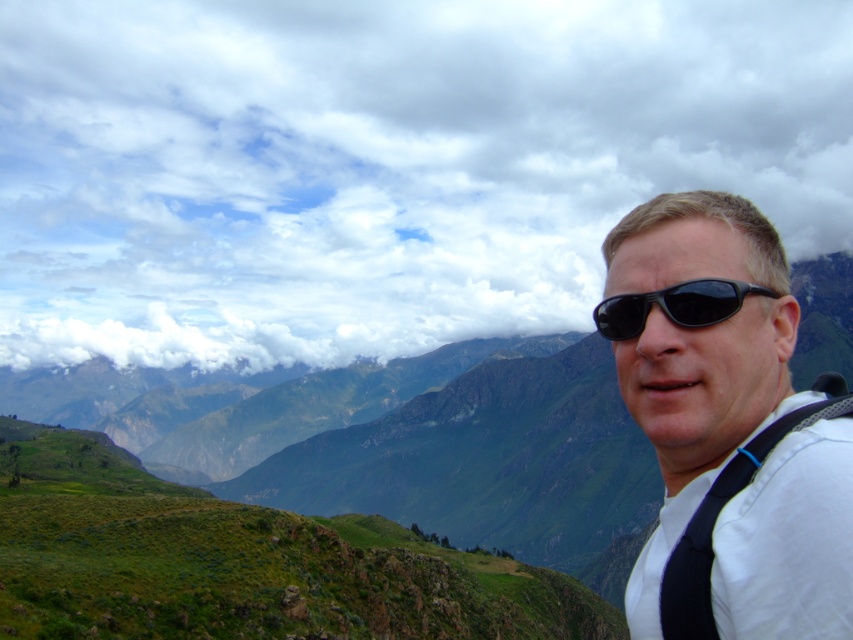
You are a drone operator preparing to capture aerial footage of the cloudy sky at upper center and the matte black sunglasses at right. The drone has a maximum range of 2300 feet. Can the drone safely capture both subjects without exceeding its range limit?

The cloudy sky at upper center and the matte black sunglasses at right are 2294.99 feet apart from each other. Since the distance between them is less than the drone maximum range of 2300 feet, the drone can safely capture both subjects without exceeding its range limit.

You are a photographer trying to capture the cloudy sky at upper center while avoiding the matte black sunglasses at right from blocking the view. Based on their positions, can you tell which one is closer to the camera?

The cloudy sky at upper center is further to the viewer than the matte black sunglasses at right, so the matte black sunglasses at right is closer to the camera and might block the view of the cloudy sky at upper center.